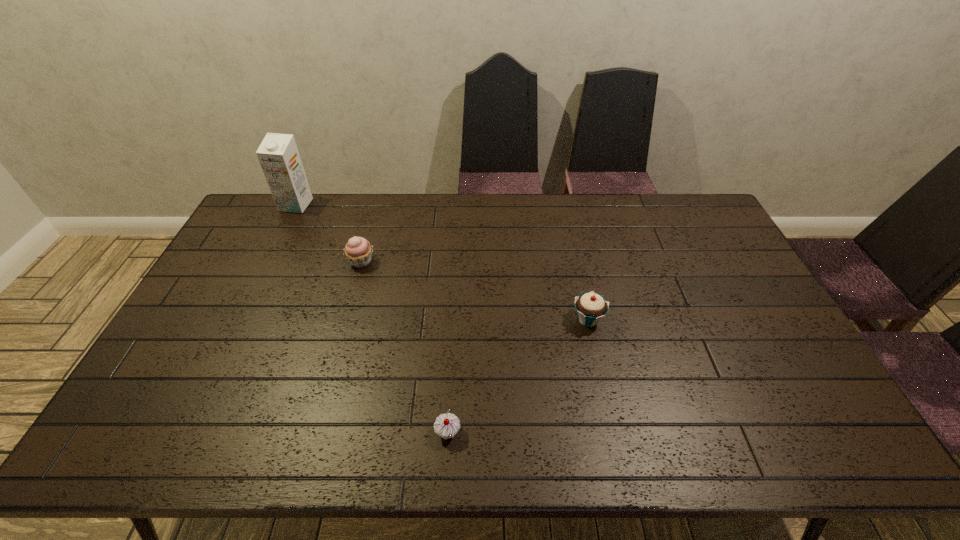
At what (x,y) coordinates should I click in order to perform the action: click on vacant space that satisfies the following two spatial constraints: 1. on the front side of the rightmost object; 2. on the left side of the farthest object. Please return your answer as a coordinate pair (x, y). Image resolution: width=960 pixels, height=540 pixels. Looking at the image, I should click on (239, 319).